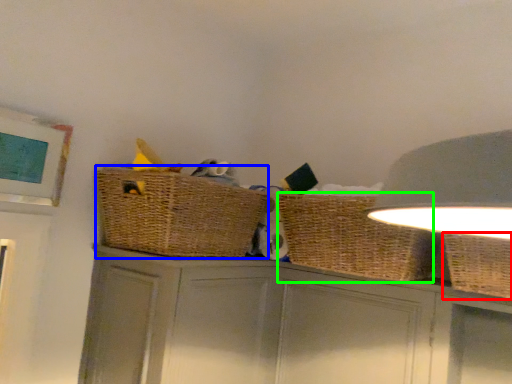
Question: Which object is positioned farthest from basket (highlighted by a red box)? Select from basket container (highlighted by a blue box) and basket (highlighted by a green box).

Choices:
 (A) basket container
 (B) basket

Answer: (A)